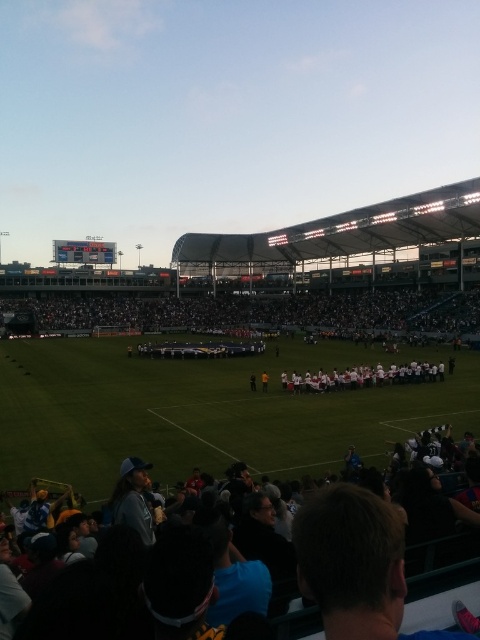
Question: Based on their relative distances, which object is farther from the dark gray fabric crowd at lower right?

Choices:
 (A) black fabric crowd at center
 (B) white fabric at center

Answer: (A)

Question: Which object appears closest to the camera in this image?

Choices:
 (A) white fabric at center
 (B) dark gray fabric crowd at lower right

Answer: (B)

Question: Is dark gray fabric crowd at lower right to the right of white fabric at center from the viewer's perspective?

Choices:
 (A) no
 (B) yes

Answer: (A)

Question: Can you confirm if dark gray fabric crowd at lower right is positioned below white fabric at center?

Choices:
 (A) no
 (B) yes

Answer: (B)

Question: Can you confirm if black fabric crowd at center is bigger than white fabric at center?

Choices:
 (A) yes
 (B) no

Answer: (A)

Question: Which point is farther from the camera taking this photo?

Choices:
 (A) (294, 387)
 (B) (424, 314)

Answer: (B)